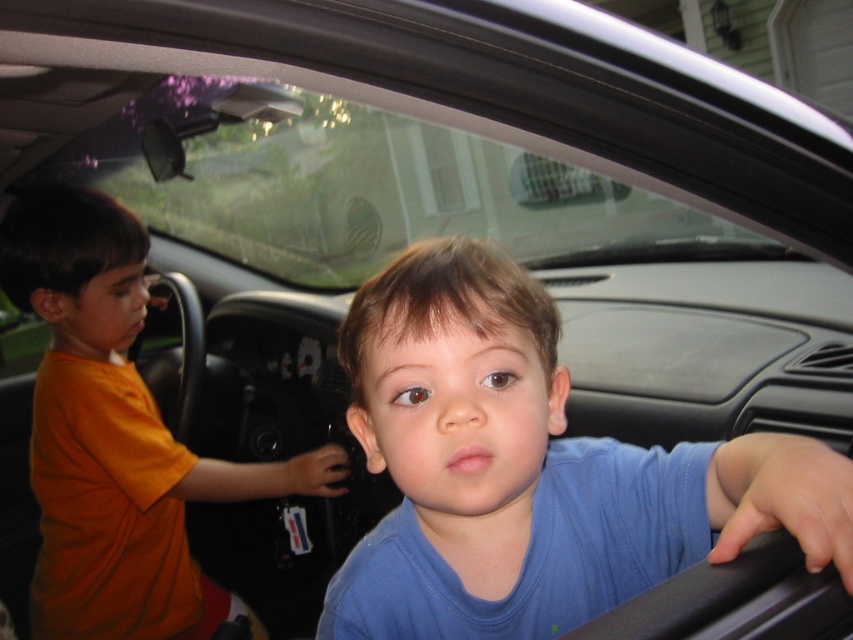
Can you confirm if blue matte shirt at center is taller than transparent glass car window at upper center?

No, blue matte shirt at center is not taller than transparent glass car window at upper center.

Is point (575, 625) positioned behind point (415, 202)?

No, (575, 625) is in front of (415, 202).

You are a GUI agent. You are given a task and a screenshot of the screen. Output one action in this format:
    pyautogui.click(x=<x>, y=<y>)
    Task: Click on the blue matte shirt at center
    Image resolution: width=853 pixels, height=640 pixels.
    Given the screenshot: What is the action you would take?
    pyautogui.click(x=532, y=468)

Who is higher up, blue matte shirt at center or orange cotton shirt at left?

blue matte shirt at center is higher up.

Can you confirm if blue matte shirt at center is positioned below orange cotton shirt at left?

Actually, blue matte shirt at center is above orange cotton shirt at left.

Is point (567, 440) closer to camera compared to point (77, 296)?

Yes.

Identify the location of blue matte shirt at center. This screenshot has height=640, width=853. (532, 468).

Can you confirm if transparent glass car window at upper center is shorter than orange cotton shirt at left?

Yes.

Does transparent glass car window at upper center have a smaller size compared to orange cotton shirt at left?

Actually, transparent glass car window at upper center might be larger than orange cotton shirt at left.

The width and height of the screenshot is (853, 640). Identify the location of transparent glass car window at upper center. (x=368, y=188).

I want to click on transparent glass car window at upper center, so click(x=368, y=188).